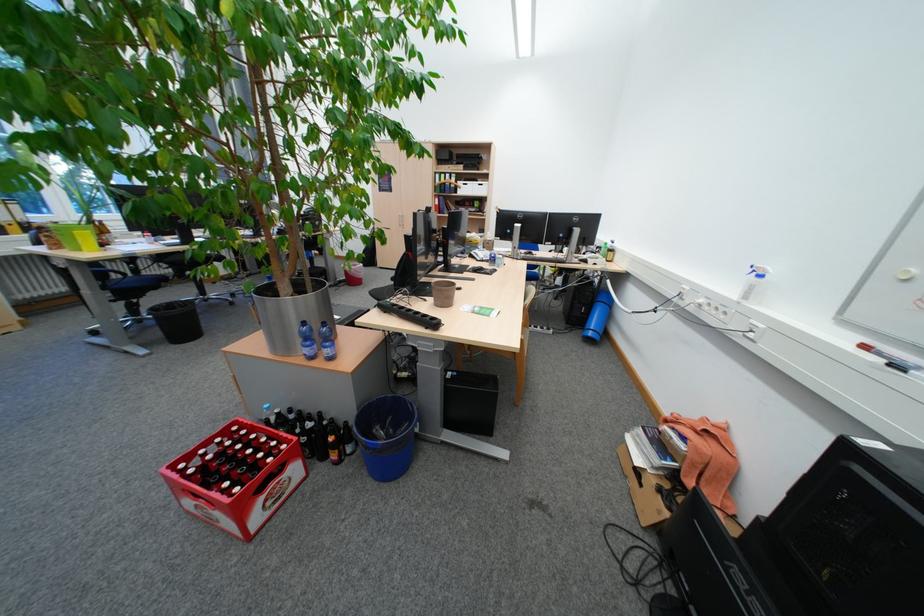
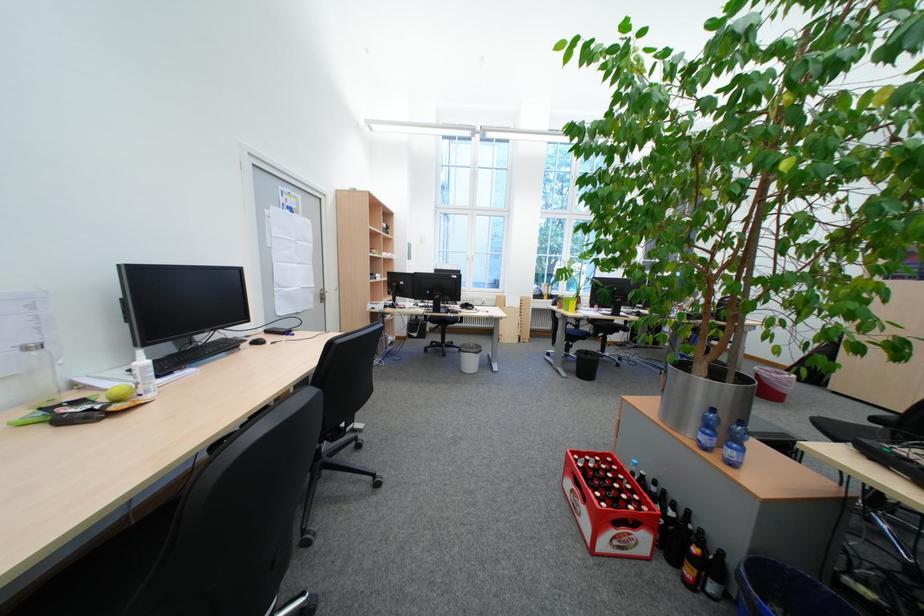
The point at [318,352] is marked in the first image. Where is the corresponding point in the second image?

(714, 439)